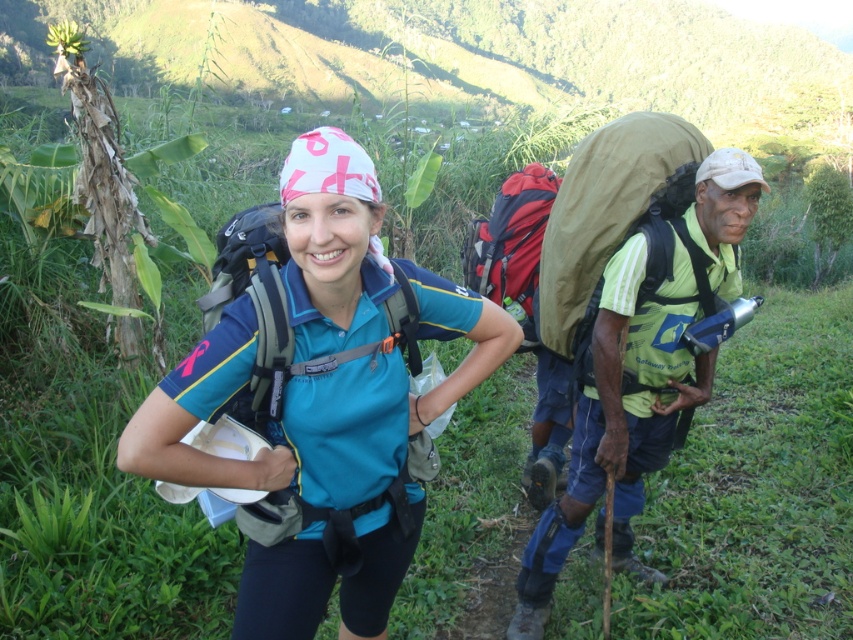
Question: Is matte blue shirt at center positioned behind green fabric backpack at right?

Choices:
 (A) no
 (B) yes

Answer: (A)

Question: Which point is closer to the camera?

Choices:
 (A) (276, 380)
 (B) (347, 208)
 (C) (509, 253)
 (D) (698, 280)

Answer: (B)

Question: Can you confirm if green fabric backpack at right is positioned to the right of red matte backpack at center?

Choices:
 (A) no
 (B) yes

Answer: (B)

Question: Is matte gray backpack at center above red matte backpack at center?

Choices:
 (A) yes
 (B) no

Answer: (B)

Question: Which of the following is the farthest from the observer?

Choices:
 (A) (473, 236)
 (B) (683, 352)

Answer: (A)

Question: Which object is positioned farthest from the matte gray backpack at center?

Choices:
 (A) red matte backpack at center
 (B) matte blue shirt at center

Answer: (A)